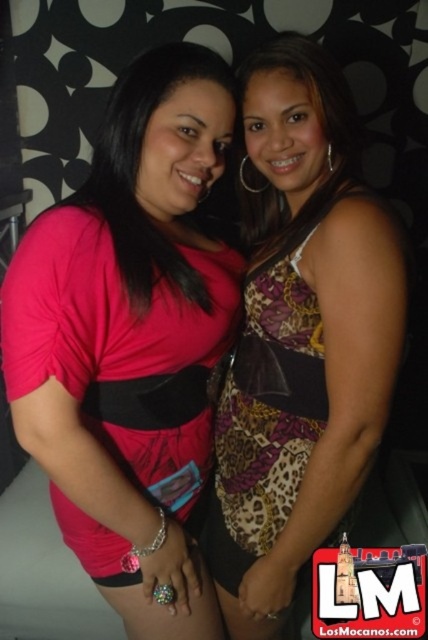
Question: From the image, what is the correct spatial relationship of pink matte shirt at center in relation to leopard print dress at center?

Choices:
 (A) below
 (B) above

Answer: (B)

Question: Is pink matte shirt at center bigger than matte pink shirt at center?

Choices:
 (A) yes
 (B) no

Answer: (A)

Question: Among these objects, which one is nearest to the camera?

Choices:
 (A) matte pink shirt at center
 (B) pink matte shirt at center

Answer: (B)

Question: Which of these objects is positioned closest to the matte pink shirt at center?

Choices:
 (A) pink matte shirt at center
 (B) leopard print dress at center

Answer: (A)

Question: Which object appears closest to the camera in this image?

Choices:
 (A) pink matte shirt at center
 (B) matte pink shirt at center
 (C) leopard print dress at center

Answer: (A)

Question: Does leopard print dress at center appear under matte pink shirt at center?

Choices:
 (A) no
 (B) yes

Answer: (B)